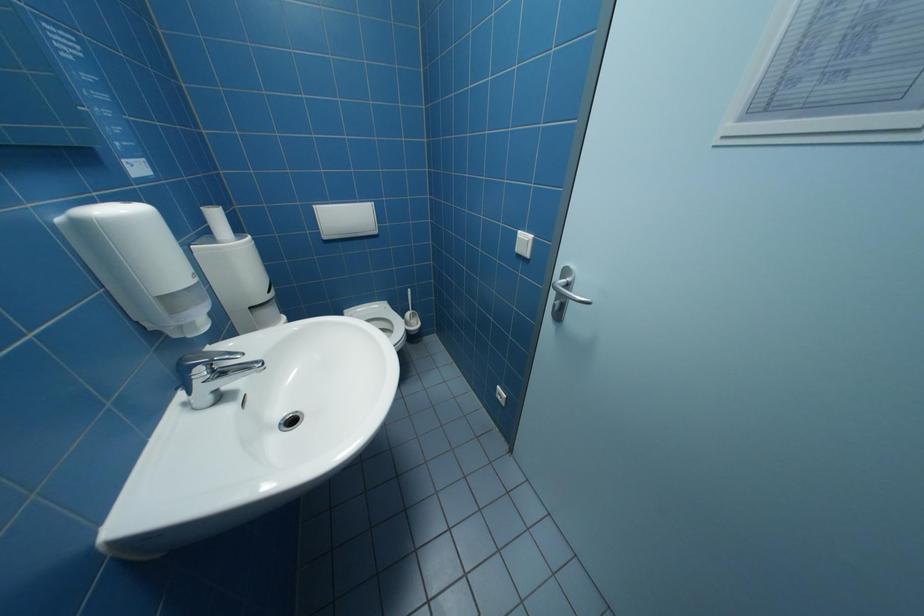
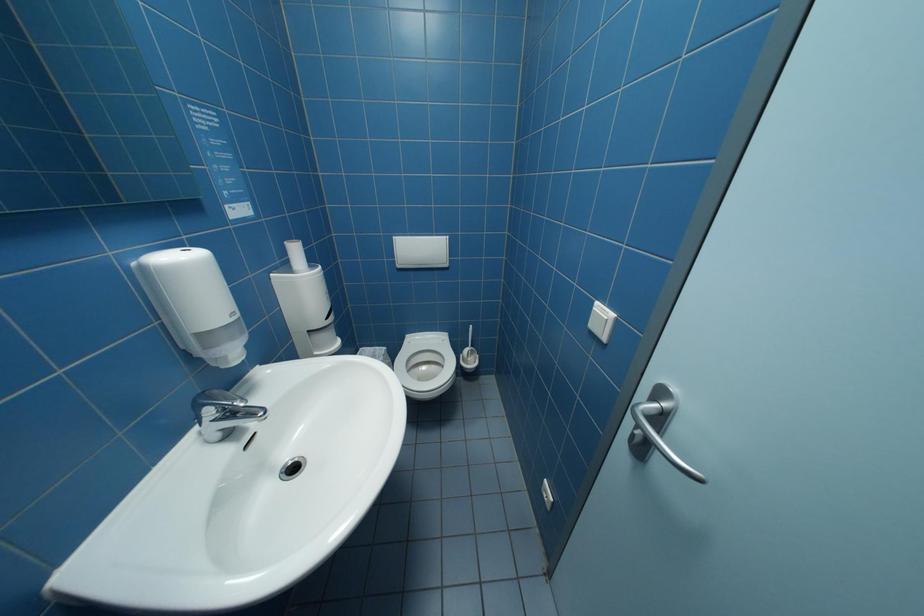
Which direction would the cameraman need to move to produce the second image?

The cameraman moved toward right, forward.